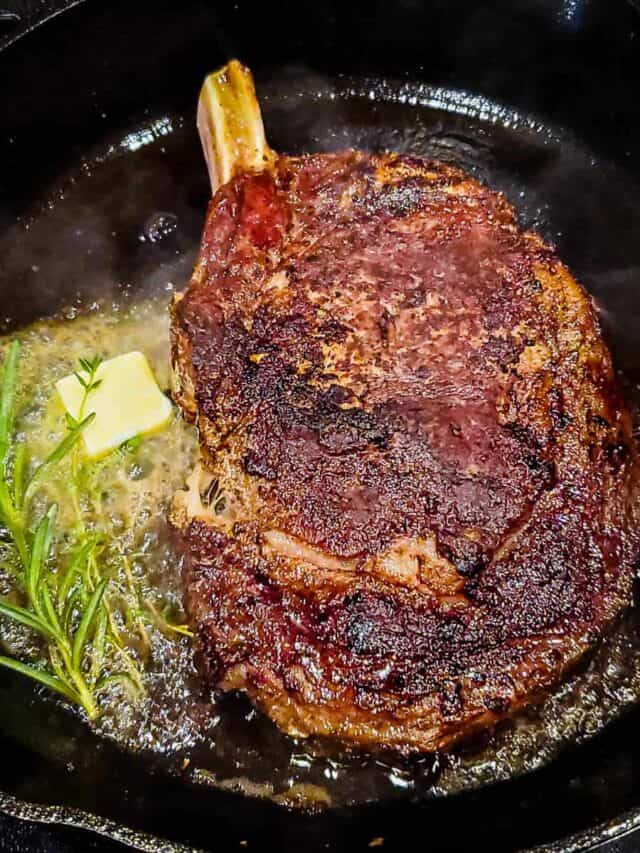
This screenshot has height=853, width=640. I want to click on edge of pan, so click(35, 15).